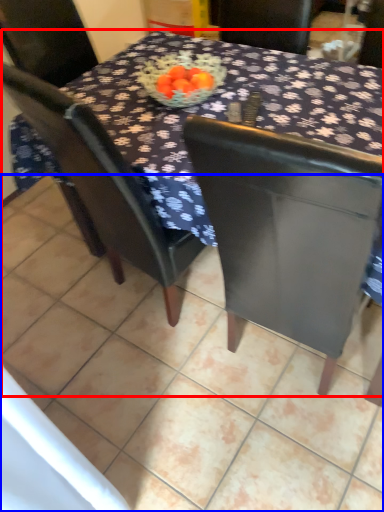
Question: Which object is further to the camera taking this photo, table (highlighted by a red box) or tile (highlighted by a blue box)?

Choices:
 (A) table
 (B) tile

Answer: (B)